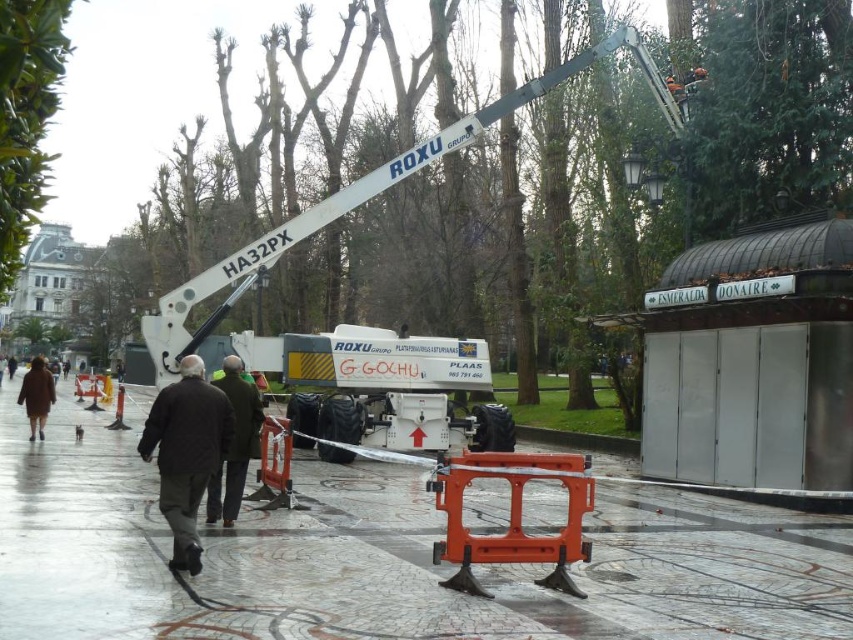
Question: Is dark brown leather jacket at center to the left of brown wool coat at lower left from the viewer's perspective?

Choices:
 (A) no
 (B) yes

Answer: (A)

Question: Which point is farther from the camera taking this photo?

Choices:
 (A) (0, 3)
 (B) (21, 582)
 (C) (212, 380)

Answer: (C)

Question: Which of the following is the closest to the observer?

Choices:
 (A) (641, 545)
 (B) (172, 499)

Answer: (B)

Question: Does green leafy tree at upper left appear on the right side of dark brown leather jacket at center?

Choices:
 (A) no
 (B) yes

Answer: (A)

Question: Where is brown woolen jacket at center located in relation to brown wool coat at lower left in the image?

Choices:
 (A) above
 (B) below

Answer: (B)

Question: Which object is positioned closest to the dark brown leather jacket at center?

Choices:
 (A) green leafy tree at upper left
 (B) brown wool coat at lower left
 (C) polished stone pavement at center
 (D) brown woolen jacket at center

Answer: (D)